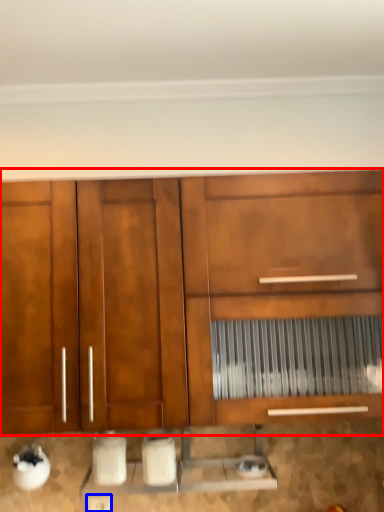
Question: Which point is closer to the camera, cabinetry (highlighted by a red box) or electric outlet (highlighted by a blue box)?

Choices:
 (A) cabinetry
 (B) electric outlet

Answer: (A)